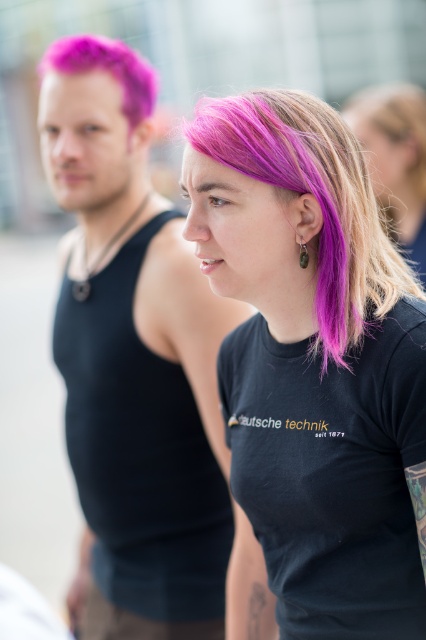
Does point (290, 163) come closer to viewer compared to point (39, 67)?

Yes, it is.

Is point (304, 465) in front of point (132, 116)?

Yes, it is in front of point (132, 116).

At what (x,y) coordinates should I click in order to perform the action: click on matte black t-shirt at center. Please return your answer as a coordinate pair (x, y). Looking at the image, I should click on (313, 362).

Can you confirm if matte black tank top at left is positioned below purple hair at center?

Indeed, matte black tank top at left is positioned under purple hair at center.

This screenshot has height=640, width=426. Describe the element at coordinates (134, 360) in the screenshot. I see `matte black tank top at left` at that location.

Identify the location of matte black tank top at left. The image size is (426, 640). (134, 360).

Can you confirm if purple matte hair at left is thinner than green stone pendant at ear?

No, purple matte hair at left is not thinner than green stone pendant at ear.

Can you confirm if purple matte hair at left is shorter than green stone pendant at ear?

Incorrect, purple matte hair at left's height does not fall short of green stone pendant at ear's.

Between point (138, 81) and point (307, 253), which one is positioned in front?

Point (307, 253) is in front.

Locate an element on the screen. The width and height of the screenshot is (426, 640). purple matte hair at left is located at coordinates (106, 68).